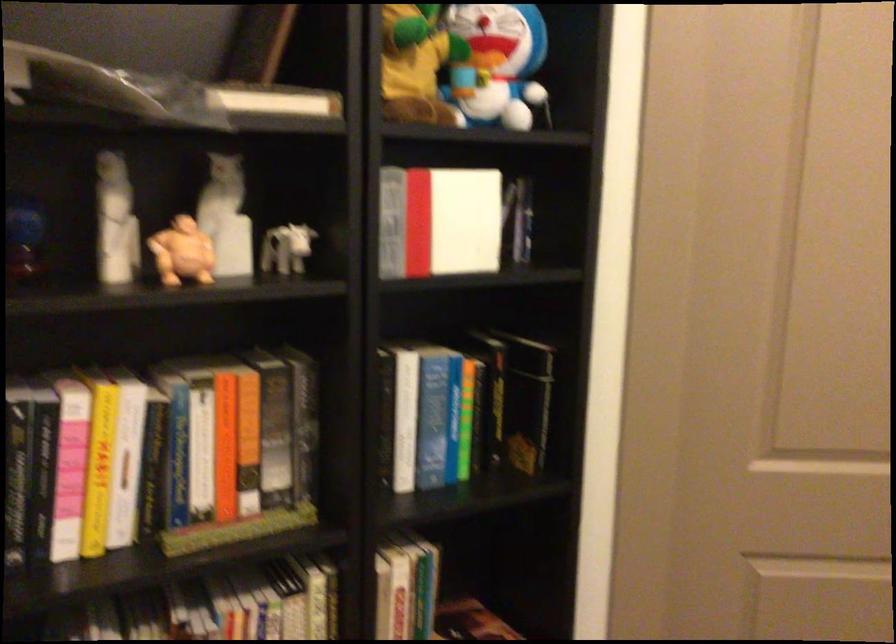
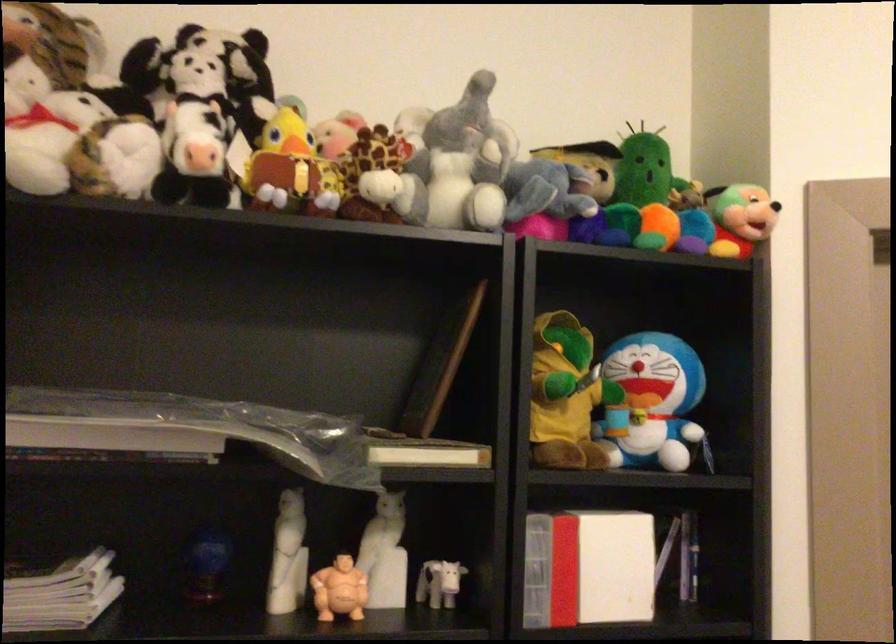
Locate, in the second image, the point that corresponds to pixel 183 254 in the first image.

(339, 589)